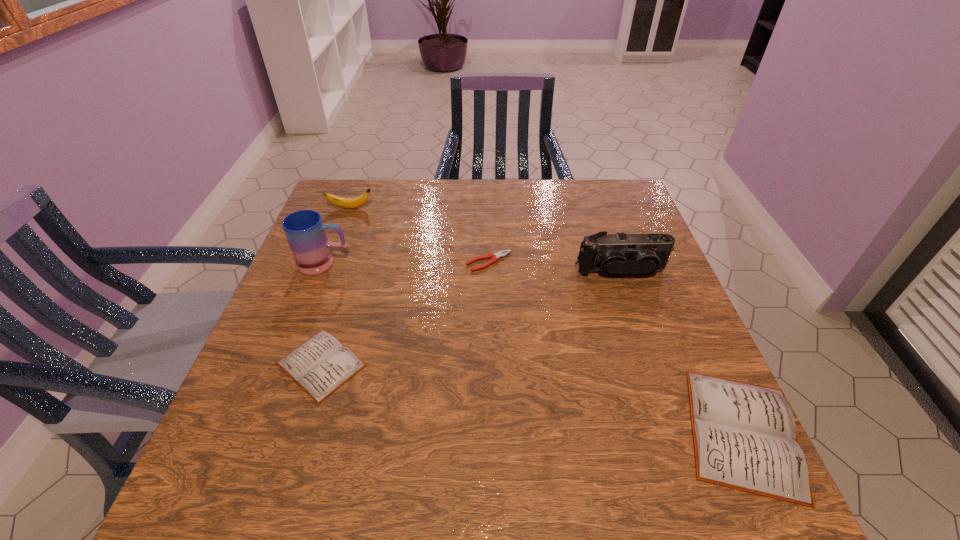
Find the location of `the left diary`. the left diary is located at coordinates (320, 365).

At what (x,y) coordinates should I click in order to perform the action: click on the second shortest object. Please return your answer as a coordinate pair (x, y). The height and width of the screenshot is (540, 960). Looking at the image, I should click on (320, 365).

At what (x,y) coordinates should I click in order to perform the action: click on the fourth tallest object. Please return your answer as a coordinate pair (x, y). Image resolution: width=960 pixels, height=540 pixels. Looking at the image, I should click on [x=744, y=437].

This screenshot has width=960, height=540. In order to click on the right diary in this screenshot , I will do `click(744, 437)`.

The height and width of the screenshot is (540, 960). I want to click on the tallest object, so click(305, 231).

This screenshot has height=540, width=960. I want to click on the shortest object, so click(x=494, y=257).

Where is `the third object from right to left`? This screenshot has height=540, width=960. the third object from right to left is located at coordinates (494, 257).

You are a GUI agent. You are given a task and a screenshot of the screen. Output one action in this format:
    pyautogui.click(x=<x>, y=<y>)
    Task: Click on the farthest object
    
    Given the screenshot: What is the action you would take?
    pyautogui.click(x=349, y=203)

This screenshot has height=540, width=960. I want to click on the fourth shortest object, so click(349, 203).

This screenshot has width=960, height=540. What are the coordinates of `the fifth shortest object` in the screenshot? It's located at (643, 254).